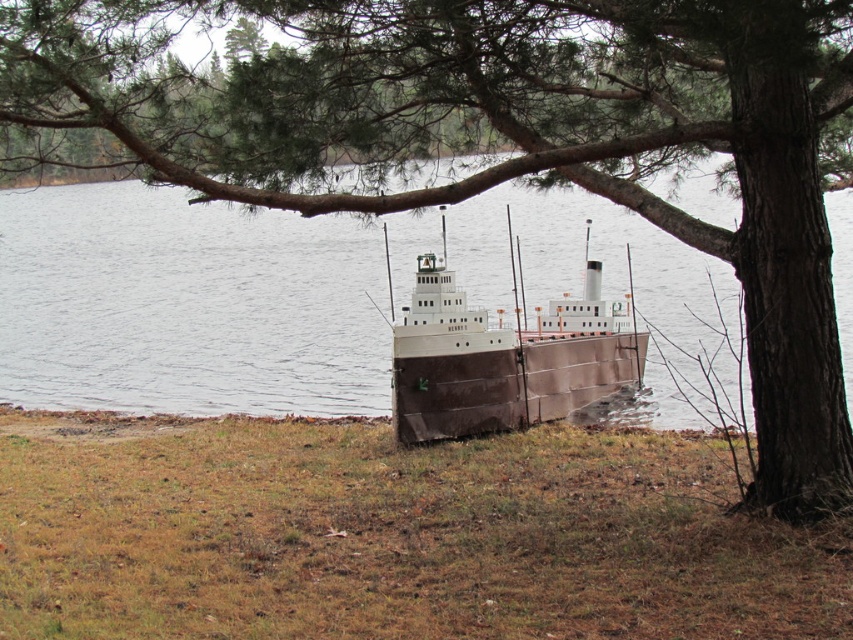
How much distance is there between brown grass at lower center and brown matte ship at center?

The distance of brown grass at lower center from brown matte ship at center is 6.55 meters.

Does point (202, 520) lie in front of point (469, 310)?

Yes, point (202, 520) is in front of point (469, 310).

The image size is (853, 640). I want to click on brown grass at lower center, so click(390, 536).